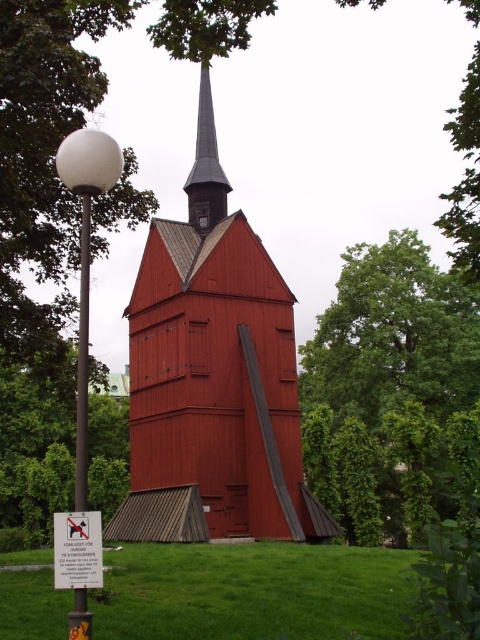
Question: Does green leafy tree at left have a larger size compared to smooth dark brown spire at center?

Choices:
 (A) no
 (B) yes

Answer: (B)

Question: Does green leafy tree at upper right appear on the left side of white glossy ball at left?

Choices:
 (A) no
 (B) yes

Answer: (A)

Question: Does white glossy ball at left appear on the left side of smooth dark brown spire at center?

Choices:
 (A) yes
 (B) no

Answer: (A)

Question: Which point appears closest to the camera in this image?

Choices:
 (A) (78, 376)
 (B) (199, 196)
 (C) (153, 492)

Answer: (A)

Question: Which point is closer to the camera?

Choices:
 (A) (2, 392)
 (B) (324, 579)
 (C) (75, 609)

Answer: (C)

Question: Among these points, which one is nearest to the camera?

Choices:
 (A) (144, 349)
 (B) (80, 547)
 (C) (200, 131)

Answer: (B)